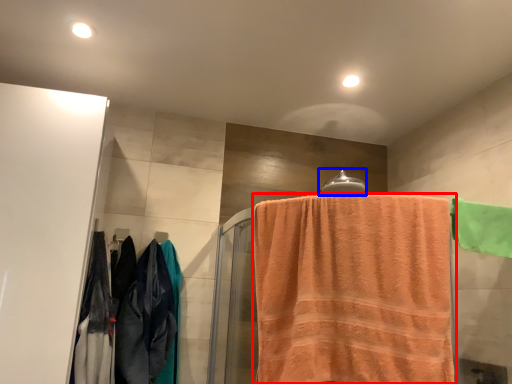
Question: Which of the following is the closest to the observer, towel (highlighted by a red box) or towel bar (highlighted by a blue box)?

Choices:
 (A) towel
 (B) towel bar

Answer: (A)